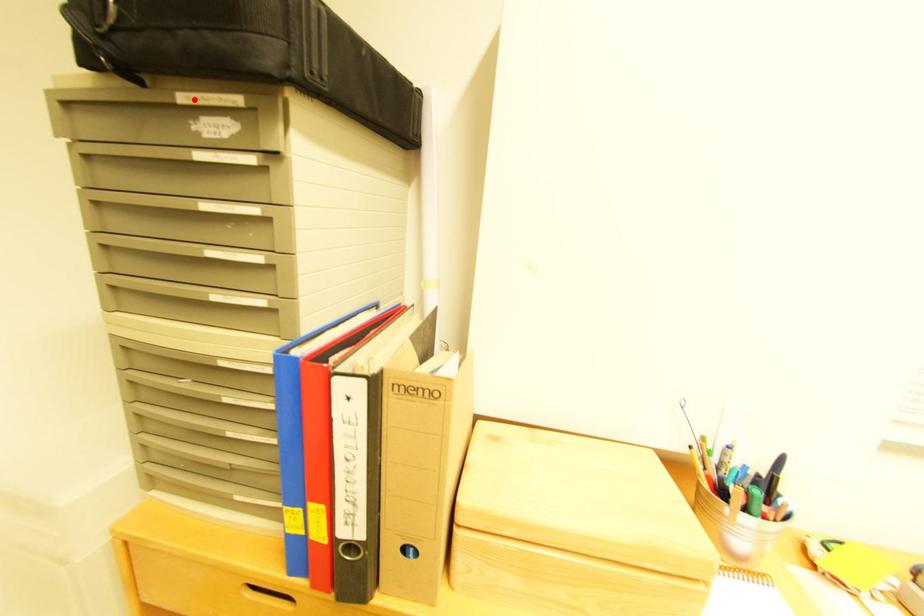
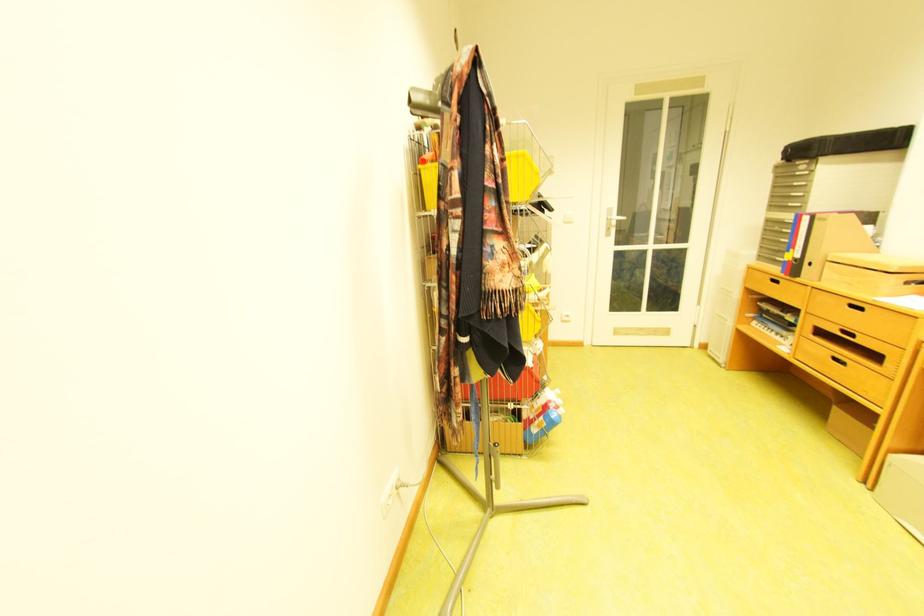
Find the pixel in the second image that matches the highlighted location in the first image.

(808, 164)